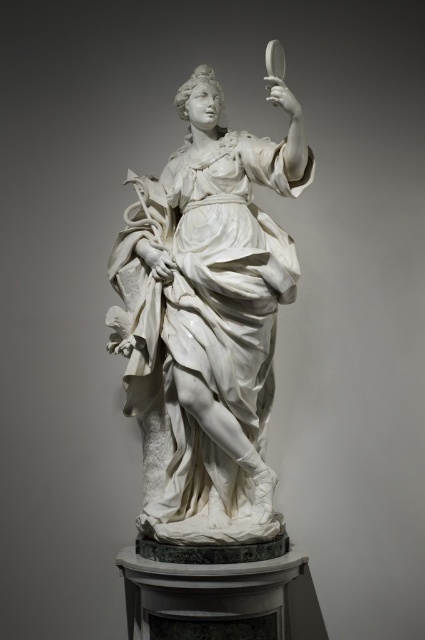
Question: Among these objects, which one is nearest to the camera?

Choices:
 (A) transparent glass magnifying glass at upper right
 (B) white marble statue at center

Answer: (B)

Question: Which object is farther from the camera taking this photo?

Choices:
 (A) transparent glass magnifying glass at upper right
 (B) white marble statue at center

Answer: (A)

Question: Does white marble statue at center appear under transparent glass magnifying glass at upper right?

Choices:
 (A) no
 (B) yes

Answer: (B)

Question: Can you confirm if white marble statue at center is thinner than transparent glass magnifying glass at upper right?

Choices:
 (A) no
 (B) yes

Answer: (A)

Question: Does white marble statue at center have a lesser width compared to transparent glass magnifying glass at upper right?

Choices:
 (A) no
 (B) yes

Answer: (A)